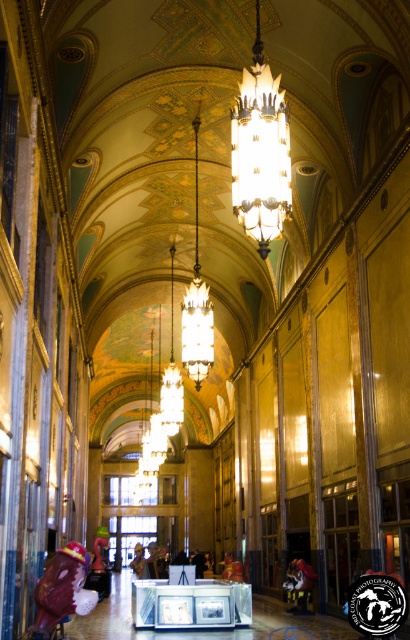
Does point (257, 131) come behind point (202, 358)?

No, (257, 131) is in front of (202, 358).

Which is above, matte glass chandelier at center or gold metallic chandelier at center?

matte glass chandelier at center is above.

Which is in front, point (257, 209) or point (195, 273)?

Point (257, 209) is in front.

Locate an element on the screen. This screenshot has width=410, height=640. matte glass chandelier at center is located at coordinates (261, 150).